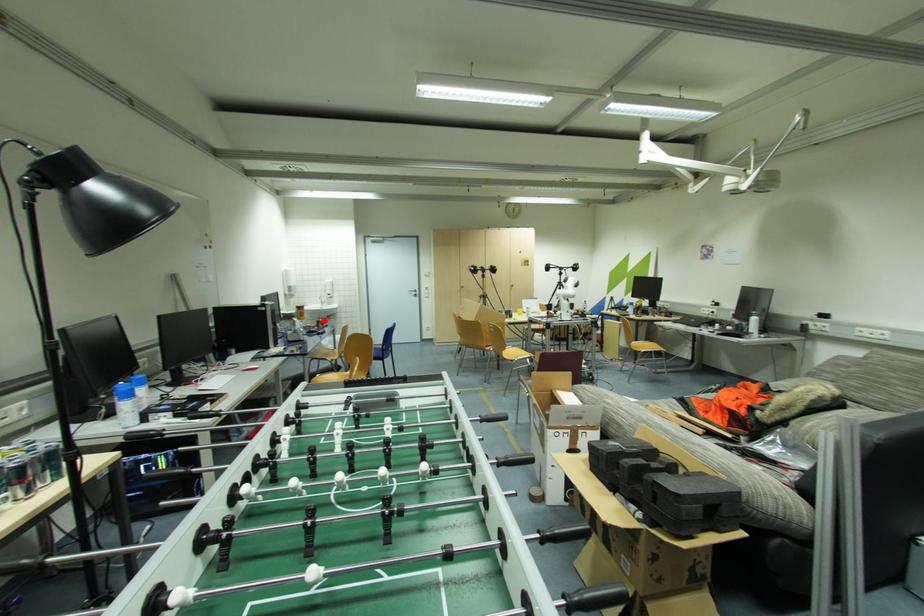
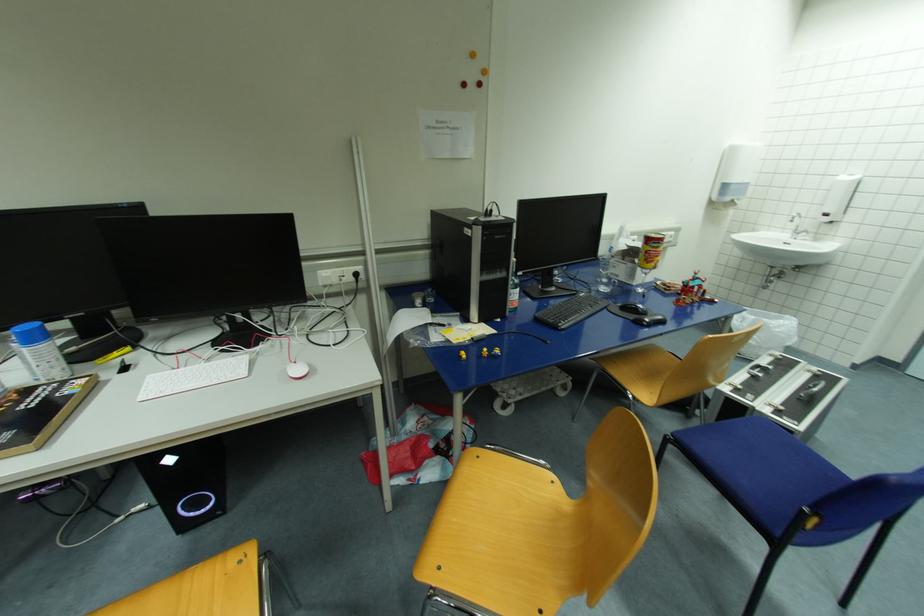
The point at the highlighted location is marked in the first image. Where is the corresponding point in the second image?

(696, 285)